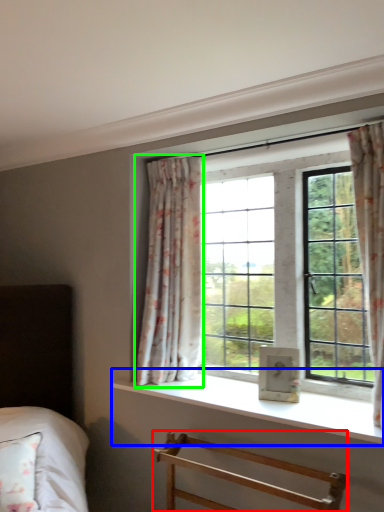
Question: Based on their relative distances, which object is nearer to furniture (highlighted by a red box)? Choose from window sill (highlighted by a blue box) and curtain (highlighted by a green box).

Choices:
 (A) window sill
 (B) curtain

Answer: (A)